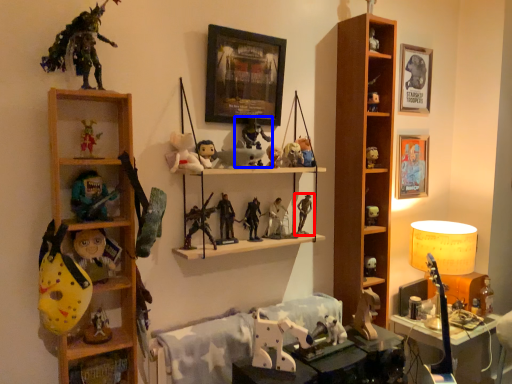
Question: Among these objects, which one is nearest to the camera, toy (highlighted by a red box) or toy (highlighted by a blue box)?

Choices:
 (A) toy
 (B) toy

Answer: (B)